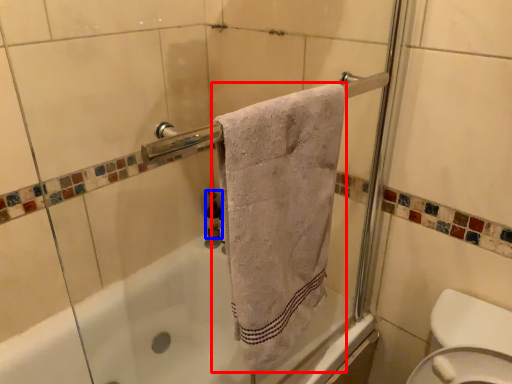
Question: Which object is closer to the camera taking this photo, towel (highlighted by a red box) or toiletry (highlighted by a blue box)?

Choices:
 (A) towel
 (B) toiletry

Answer: (A)